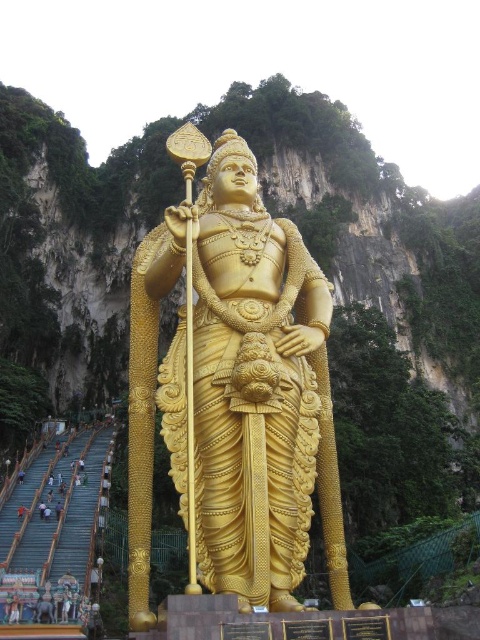
Question: Which point is closer to the camera?

Choices:
 (A) (59, 515)
 (B) (188, 435)

Answer: (B)

Question: Is gold polished statue at center smaller than light brown skin at lower left?

Choices:
 (A) yes
 (B) no

Answer: (B)

Question: Among these objects, which one is farthest from the camera?

Choices:
 (A) light brown skin at lower left
 (B) gold polished statue at center

Answer: (A)

Question: Does gold polished statue at center appear on the left side of light brown skin at lower left?

Choices:
 (A) no
 (B) yes

Answer: (A)

Question: Does gold polished statue at center have a lesser width compared to light brown skin at lower left?

Choices:
 (A) yes
 (B) no

Answer: (B)